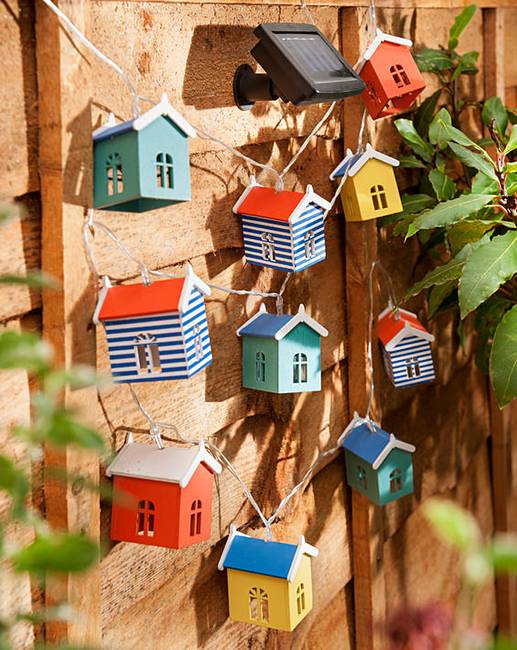
You are a GUI agent. You are given a task and a screenshot of the screen. Output one action in this format:
    pyautogui.click(x=<x>, y=<y>)
    Task: Click on the walls
    The height and width of the screenshot is (650, 517).
    Given the screenshot: What is the action you would take?
    pyautogui.click(x=168, y=526), pyautogui.click(x=264, y=590), pyautogui.click(x=178, y=341), pyautogui.click(x=143, y=147), pyautogui.click(x=279, y=368), pyautogui.click(x=364, y=470), pyautogui.click(x=418, y=359), pyautogui.click(x=279, y=216), pyautogui.click(x=377, y=188), pyautogui.click(x=392, y=88)